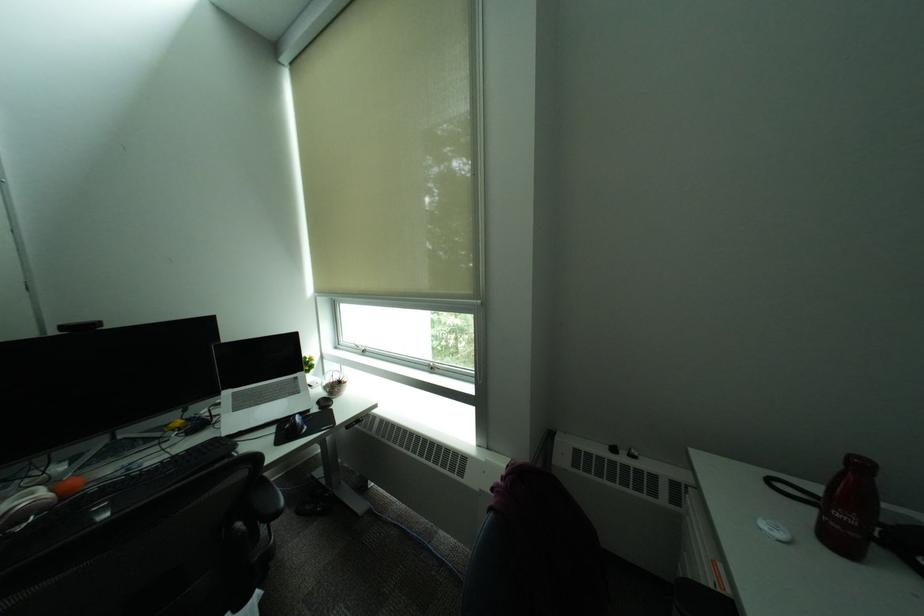
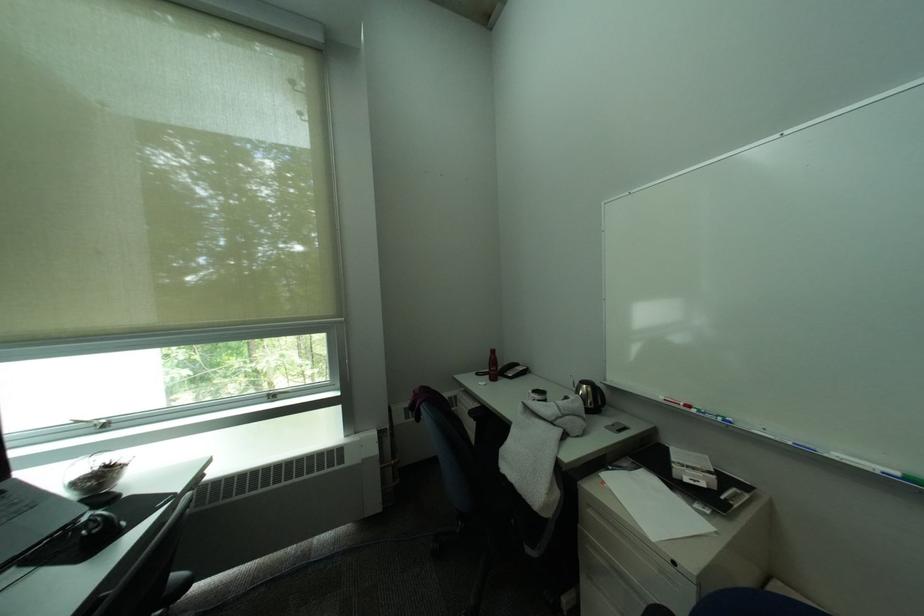
In the second image, find the point that corresponds to [847,516] in the first image.

(503, 370)